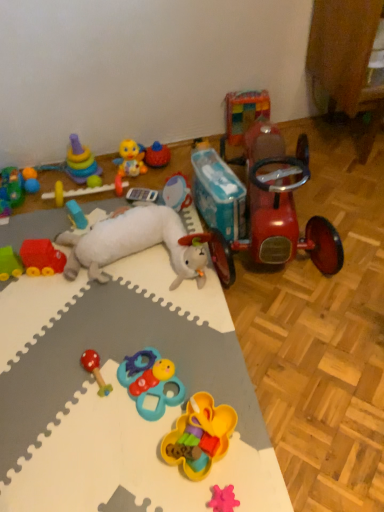
Locate an element on the screen. This screenshot has height=512, width=384. blank area to the left of rubberized plastic toy at center, the fourth toy from the left is located at coordinates (42, 207).